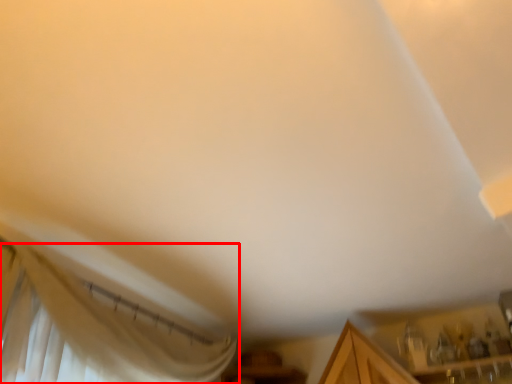
Question: From the image's perspective, what is the correct spatial positioning of curtain (annotated by the red box) in reference to cabinetry?

Choices:
 (A) below
 (B) above

Answer: (B)